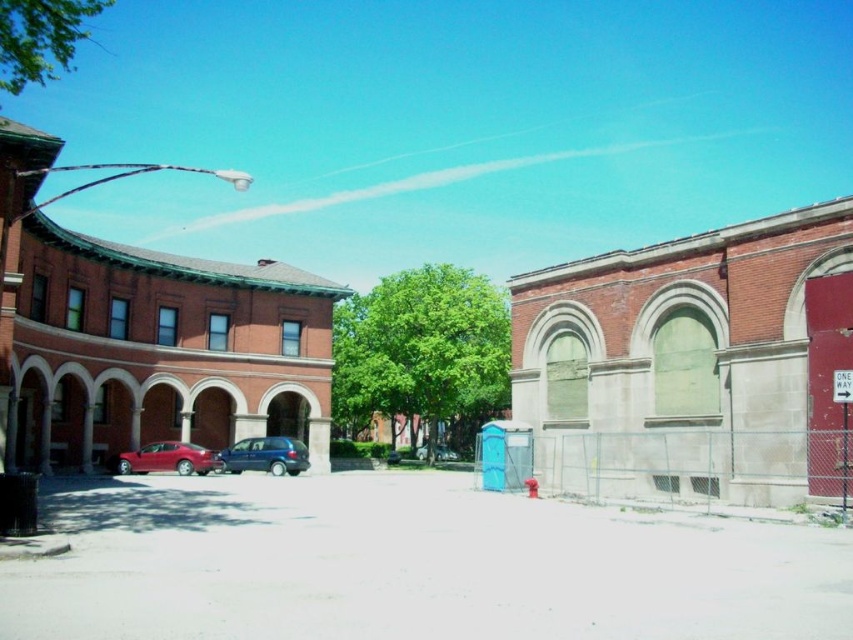
Does metallic blue minivan at center have a greater height compared to shiny red sedan at lower left?

Yes, metallic blue minivan at center is taller than shiny red sedan at lower left.

Can you confirm if metallic blue minivan at center is bigger than shiny red sedan at lower left?

Indeed, metallic blue minivan at center has a larger size compared to shiny red sedan at lower left.

Which is in front, point (238, 458) or point (158, 467)?

Point (158, 467)

At what (x,y) coordinates should I click in order to perform the action: click on metallic blue minivan at center. Please return your answer as a coordinate pair (x, y). Looking at the image, I should click on (265, 456).

Is chain-link fence at lower right above metallic blue minivan at center?

Indeed, chain-link fence at lower right is positioned over metallic blue minivan at center.

Where is `chain-link fence at lower right`? chain-link fence at lower right is located at coordinates (691, 467).

This screenshot has height=640, width=853. What do you see at coordinates (691, 467) in the screenshot?
I see `chain-link fence at lower right` at bounding box center [691, 467].

Find the location of a particular element. chain-link fence at lower right is located at coordinates (691, 467).

Who is more forward, (746,481) or (141,452)?

Point (746,481)

Which of these two, chain-link fence at lower right or shiny red sedan at lower left, stands shorter?

shiny red sedan at lower left

Between point (727, 467) and point (163, 456), which one is positioned in front?

Positioned in front is point (727, 467).

Identify the location of chain-link fence at lower right. (691, 467).